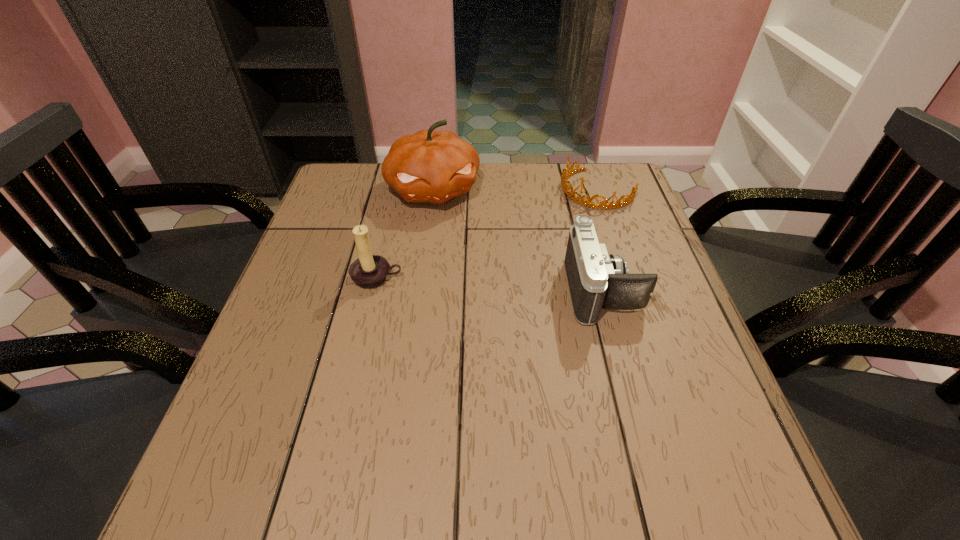
Locate an element on the screen. This screenshot has height=540, width=960. vacant area that lies between the camera and the pumpkin is located at coordinates (518, 240).

This screenshot has height=540, width=960. Find the location of `vacant space that is in between the candle holder and the tiara`. vacant space that is in between the candle holder and the tiara is located at coordinates (487, 233).

Where is `vacant space that's between the candle holder and the pumpkin`? The height and width of the screenshot is (540, 960). vacant space that's between the candle holder and the pumpkin is located at coordinates (405, 234).

You are a GUI agent. You are given a task and a screenshot of the screen. Output one action in this format:
    pyautogui.click(x=<x>, y=<y>)
    Task: Click on the blank region between the candle holder and the tallest object
    The width and height of the screenshot is (960, 540).
    Given the screenshot: What is the action you would take?
    pyautogui.click(x=405, y=234)

Locate which object is the third closest to the camera. Please provide its 2D coordinates. Your answer should be formatted as a tuple, i.e. [(x, y)], where the tuple contains the x and y coordinates of a point satisfying the conditions above.

[(369, 271)]

Locate which object ranks second in proximity to the tiara. Please provide its 2D coordinates. Your answer should be formatted as a tuple, i.e. [(x, y)], where the tuple contains the x and y coordinates of a point satisfying the conditions above.

[(429, 166)]

This screenshot has width=960, height=540. In order to click on vacant space that satisfies the following two spatial constraints: 1. on the wick of the candle holder; 2. at the front of the camera with an open lens cover in this screenshot , I will do `click(374, 291)`.

Locate an element on the screen. Image resolution: width=960 pixels, height=540 pixels. blank area in the image that satisfies the following two spatial constraints: 1. on the wick of the camera; 2. at the front of the candle holder with an open lens cover is located at coordinates (374, 291).